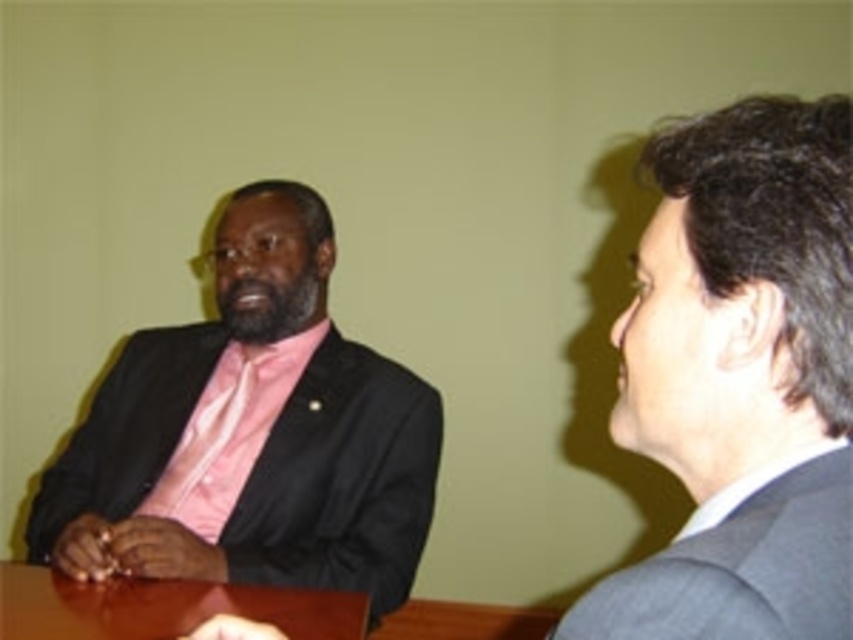
You are standing at the entrance of the conference room and see two points marked in the image. The first point is at coordinates point (x=689, y=129) and the second is at point (x=65, y=620). Which point is closer to you?

Point (x=689, y=129) is in front of point (x=65, y=620), so the first point is closer to you.

You are standing in the conference room and want to place a small note on the table. The note must be placed exactly at the point with coordinates point [251,433]. Where should you place the note relative to the person in the matte black suit at left?

The point [251,433] is located on the matte black suit at left, so you should place the note directly on the matte black suit at left.